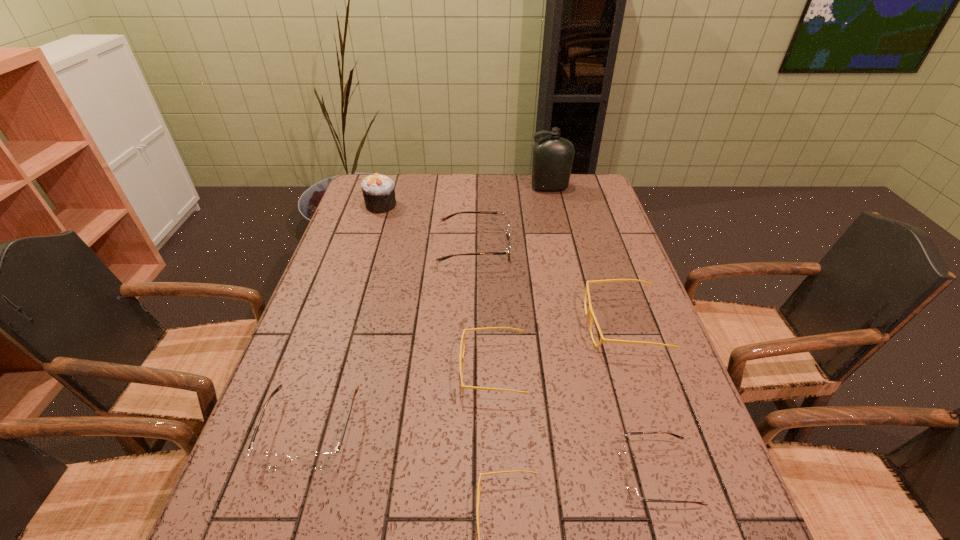
This screenshot has height=540, width=960. Identify the location of vacant area situated 0.080m in front of the lenses of the second biggest beige spectacles. (425, 369).

The height and width of the screenshot is (540, 960). Identify the location of vacant region located on the front-facing side of the rightmost brown spectacles. (416, 475).

Locate an element on the screen. vacant space located 0.290m on the front-facing side of the rightmost brown spectacles is located at coordinates (468, 475).

Where is `free location located on the front-facing side of the rightmost brown spectacles`? This screenshot has width=960, height=540. free location located on the front-facing side of the rightmost brown spectacles is located at coordinates (564, 475).

Image resolution: width=960 pixels, height=540 pixels. Find the location of `bottle that is at the far edge`. bottle that is at the far edge is located at coordinates (553, 156).

Locate an element on the screen. The image size is (960, 540). cupcake positioned at the far edge is located at coordinates (378, 190).

You are a GUI agent. You are given a task and a screenshot of the screen. Output one action in this format:
    pyautogui.click(x=<x>, y=<y>)
    Task: Click on the cupcake that is at the left edge
    This screenshot has width=960, height=540.
    Given the screenshot: What is the action you would take?
    pyautogui.click(x=378, y=190)

This screenshot has height=540, width=960. Identify the location of spectacles present at the left edge. (322, 460).

Where is `bottle situated at the right edge`? Image resolution: width=960 pixels, height=540 pixels. bottle situated at the right edge is located at coordinates (553, 156).

Identify the location of object that is at the far left corner. Image resolution: width=960 pixels, height=540 pixels. (378, 190).